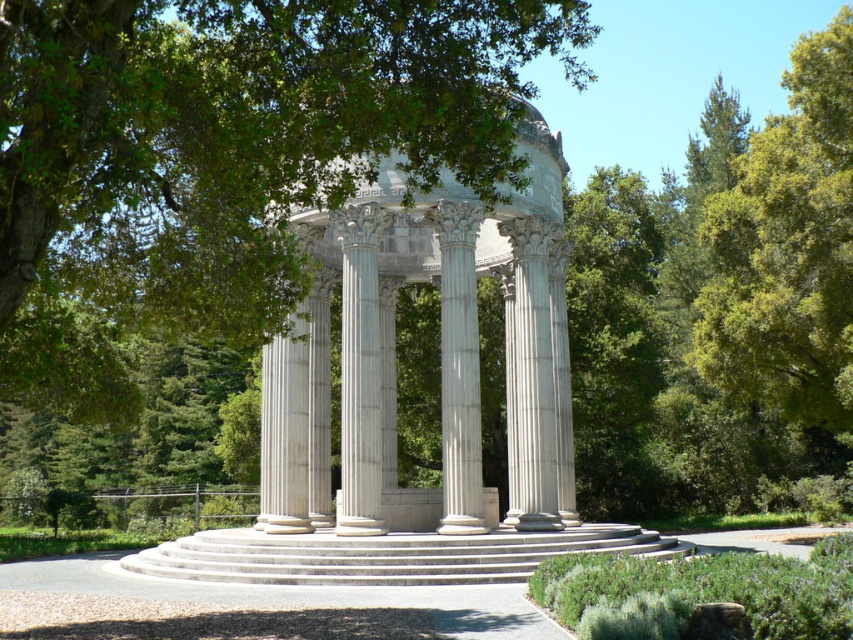
Can you confirm if green leafy tree at center is taller than white marble column at center?

Indeed, green leafy tree at center has a greater height compared to white marble column at center.

Does green leafy tree at center have a lesser height compared to white marble column at center?

In fact, green leafy tree at center may be taller than white marble column at center.

Where is `green leafy tree at center`? The image size is (853, 640). green leafy tree at center is located at coordinates coord(223,156).

Where is `green leafy tree at center`? This screenshot has height=640, width=853. green leafy tree at center is located at coordinates (223, 156).

Between white marble gazebo at center and white marble column at center, which one has less height?

Standing shorter between the two is white marble column at center.

Where is `white marble gazebo at center`? This screenshot has height=640, width=853. white marble gazebo at center is located at coordinates (456, 337).

Locate an element on the screen. This screenshot has height=640, width=853. white marble gazebo at center is located at coordinates [x=456, y=337].

Is green leafy tree at center taller than white marble gazebo at center?

Yes, green leafy tree at center is taller than white marble gazebo at center.

Describe the element at coordinates (223, 156) in the screenshot. I see `green leafy tree at center` at that location.

Find the location of a particular element. green leafy tree at center is located at coordinates (223, 156).